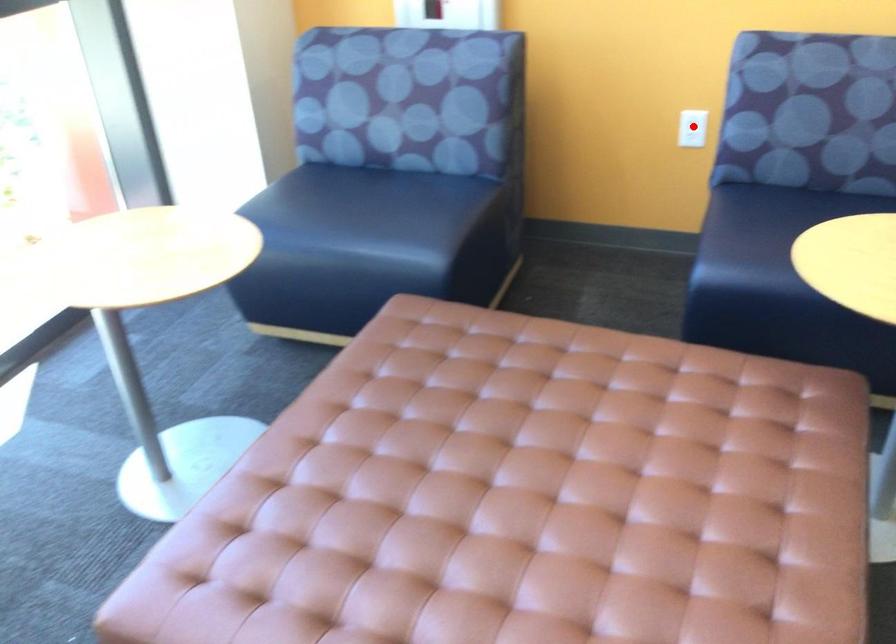
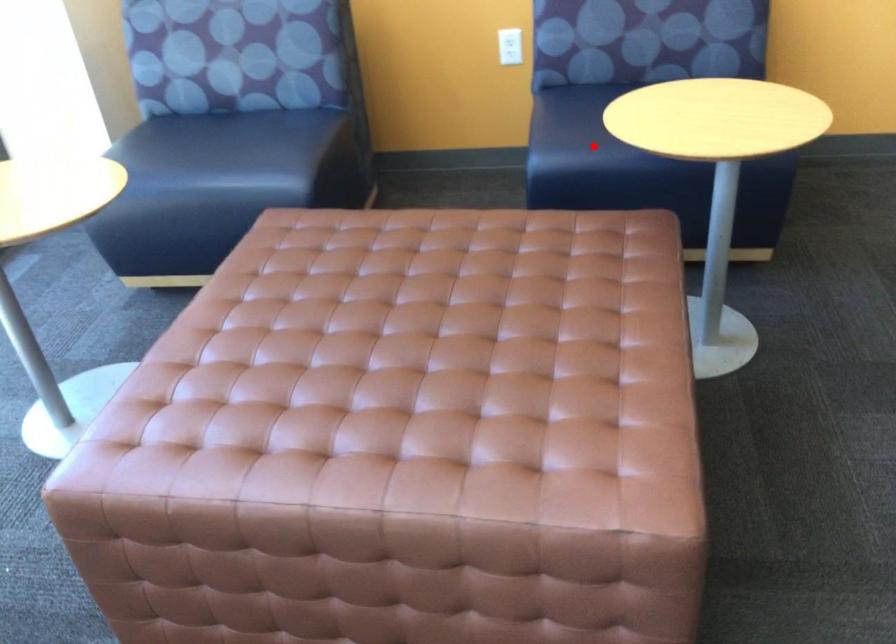
I am providing you with two images of the same scene from different viewpoints. A red point is marked on the first image and another point is marked on the second image. Does the point marked in image1 correspond to the same location as the one in image2?

No